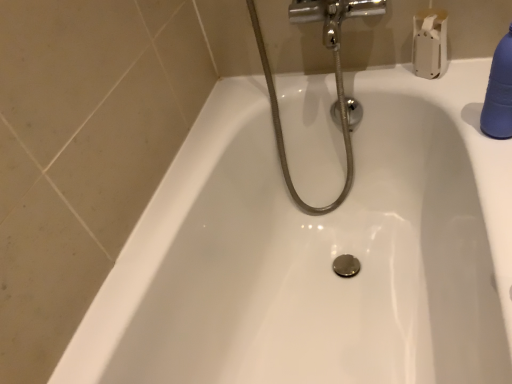
Question: From a real-world perspective, is chrome metallic showerhead at upper center positioned under blue rubber bottle at upper right based on gravity?

Choices:
 (A) no
 (B) yes

Answer: (B)

Question: Is chrome metallic showerhead at upper center not inside blue rubber bottle at upper right?

Choices:
 (A) yes
 (B) no

Answer: (A)

Question: Does chrome metallic showerhead at upper center appear on the left side of blue rubber bottle at upper right?

Choices:
 (A) no
 (B) yes

Answer: (B)

Question: From a real-world perspective, does chrome metallic showerhead at upper center stand above blue rubber bottle at upper right?

Choices:
 (A) yes
 (B) no

Answer: (B)

Question: From the image's perspective, would you say chrome metallic showerhead at upper center is positioned over blue rubber bottle at upper right?

Choices:
 (A) no
 (B) yes

Answer: (B)

Question: Considering the positions of blue rubber bottle at upper right and chrome metallic showerhead at upper center in the image, is blue rubber bottle at upper right bigger or smaller than chrome metallic showerhead at upper center?

Choices:
 (A) small
 (B) big

Answer: (A)

Question: From the image's perspective, relative to chrome metallic showerhead at upper center, is blue rubber bottle at upper right above or below?

Choices:
 (A) below
 (B) above

Answer: (A)

Question: Do you think blue rubber bottle at upper right is within chrome metallic showerhead at upper center, or outside of it?

Choices:
 (A) outside
 (B) inside

Answer: (A)

Question: Considering the positions of point (500, 61) and point (252, 18), is point (500, 61) closer or farther from the camera than point (252, 18)?

Choices:
 (A) farther
 (B) closer

Answer: (B)

Question: From the image's perspective, relative to blue rubber bottle at upper right, is chrome metallic showerhead at upper center above or below?

Choices:
 (A) below
 (B) above

Answer: (B)

Question: Is chrome metallic showerhead at upper center inside or outside of blue rubber bottle at upper right?

Choices:
 (A) outside
 (B) inside

Answer: (A)

Question: From a real-world perspective, relative to blue rubber bottle at upper right, is chrome metallic showerhead at upper center vertically above or below?

Choices:
 (A) below
 (B) above

Answer: (A)

Question: Is chrome metallic showerhead at upper center in front of or behind blue rubber bottle at upper right in the image?

Choices:
 (A) behind
 (B) front

Answer: (A)

Question: Is chrome metallic showerhead at upper center situated inside white matte toilet paper at upper right or outside?

Choices:
 (A) outside
 (B) inside

Answer: (A)

Question: Based on their sizes in the image, would you say chrome metallic showerhead at upper center is bigger or smaller than white matte toilet paper at upper right?

Choices:
 (A) big
 (B) small

Answer: (A)